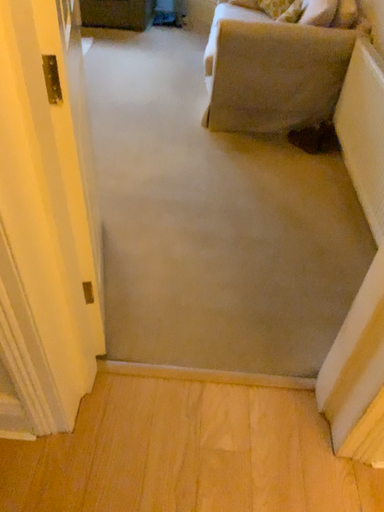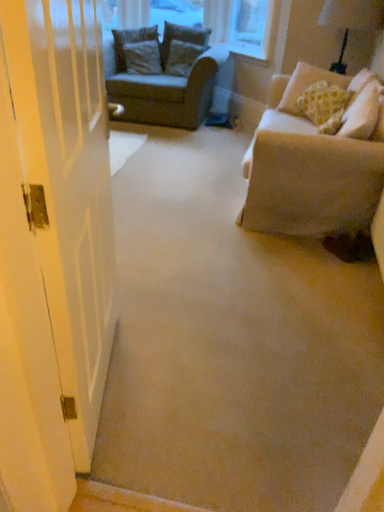
Question: Which way did the camera rotate in the video?

Choices:
 (A) rotated upward
 (B) rotated downward

Answer: (A)